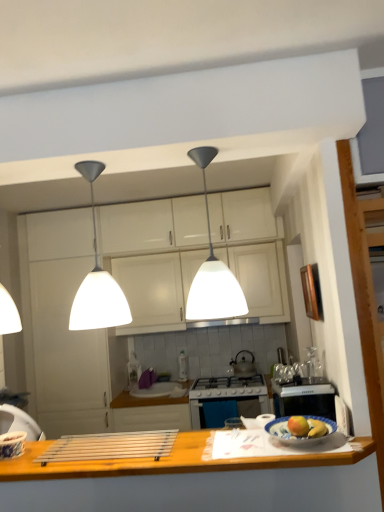
Locate an element on the screen. free spot above blue glossy plate at lower right (from a real-world perspective) is located at coordinates (306, 424).